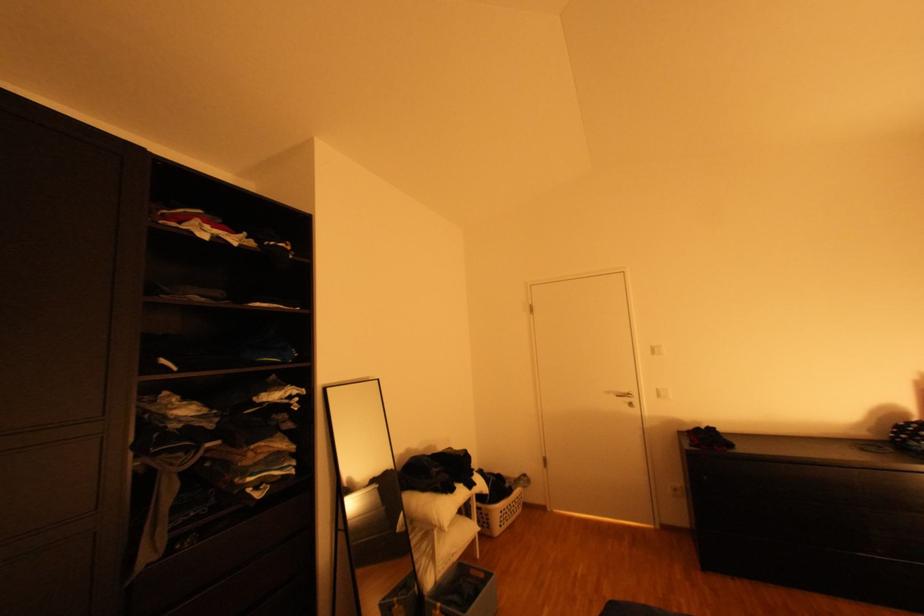
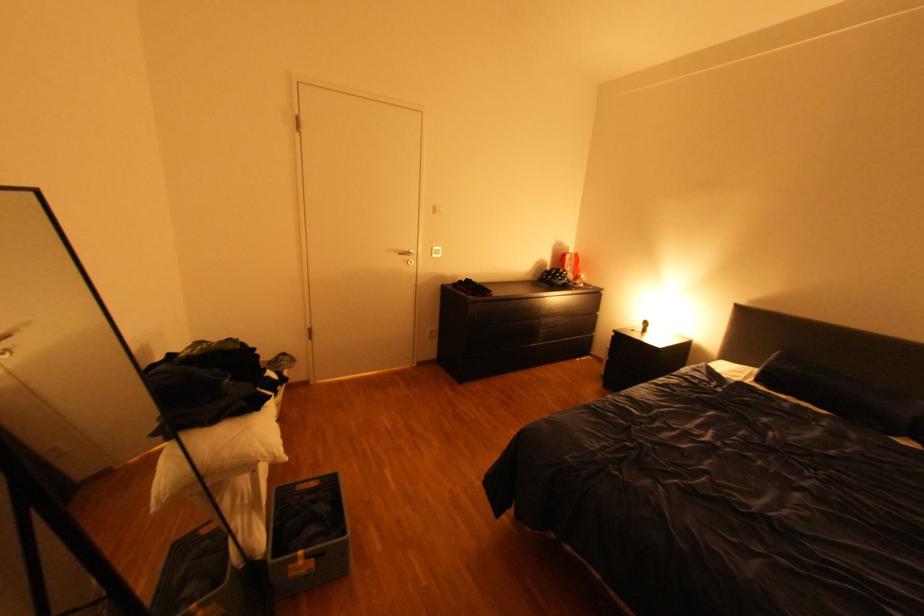
Locate, in the second image, the point that corresponds to pixel 433 490 in the first image.

(223, 421)